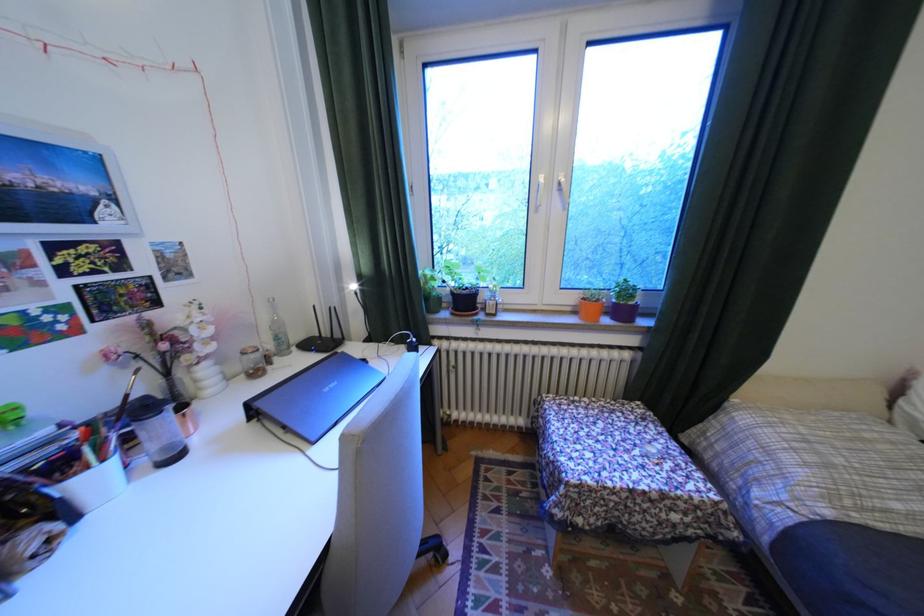
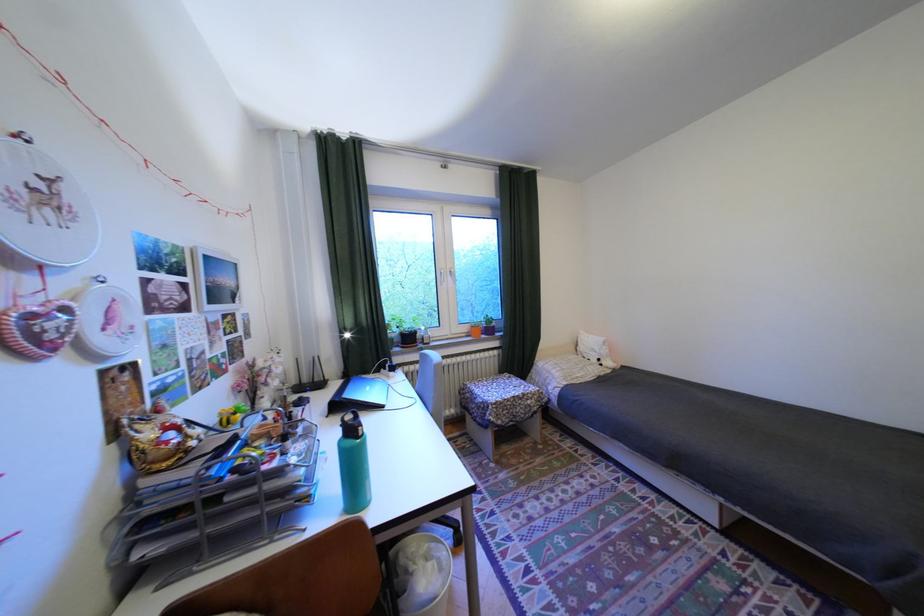
Where in the second image is the point corresponding to point (591, 521) from the first image?

(512, 422)